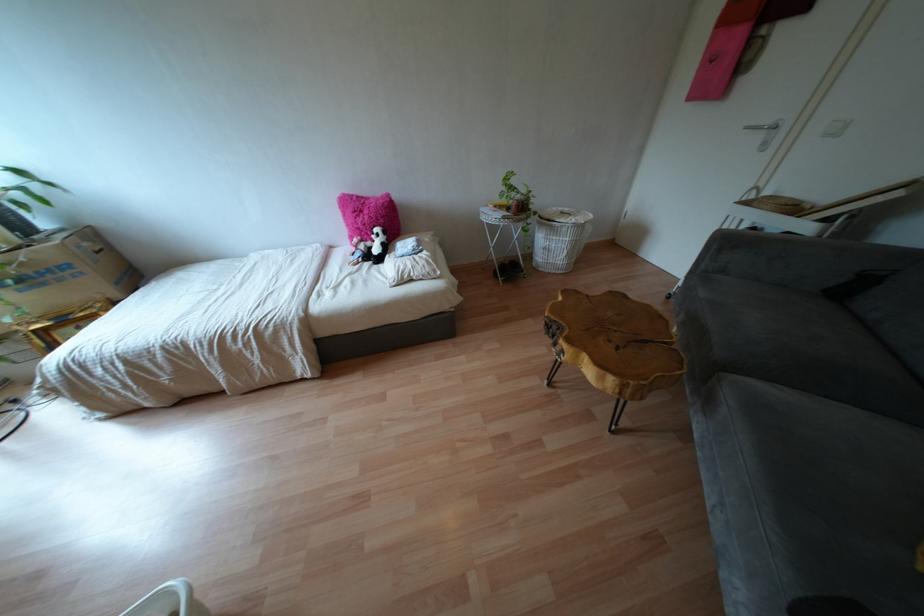
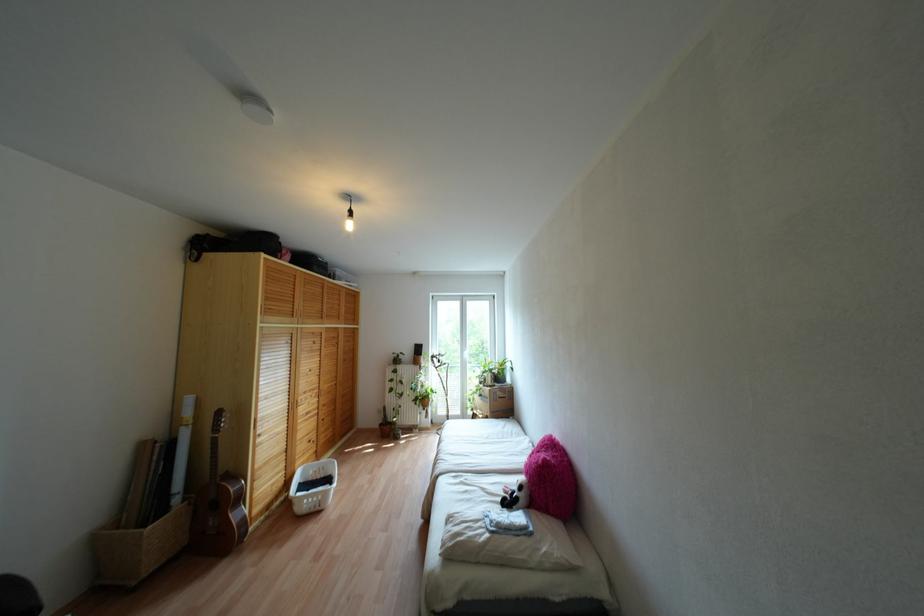
Locate, in the second image, the point that corresponds to pixel 349 274 in the first image.

(482, 488)